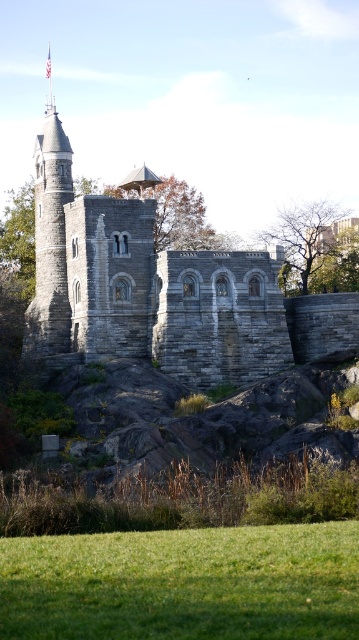
You are a photographer planning to capture a photo of the gray stone tower at left from the green grassy field at lower center. Considering their heights, will the tower be fully visible in the photo without any obstruction?

The green grassy field at lower center is shorter than the gray stone tower at left, so the tower will be fully visible in the photo without any obstruction as the field does not block its height.

You are standing at the bottom of the castle structure and want to find the green grassy field at lower center. According to the coordinates provided, where should you look relative to your position?

The green grassy field at lower center is located at coordinates approximately 0.912 on the x axis and 0.510 on the y axis, so you should look towards the lower right direction from your current position at the bottom of the castle structure.